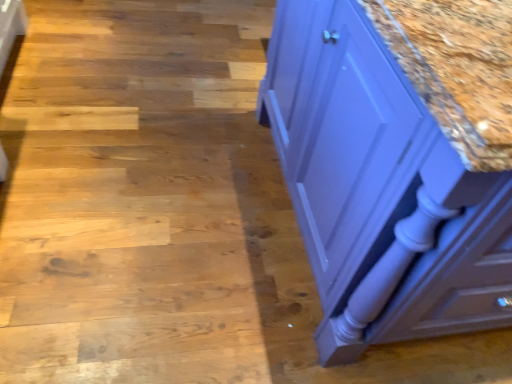
Question: Should I look upward or downward to see matte purple cabinet at right?

Choices:
 (A) up
 (B) down

Answer: (A)